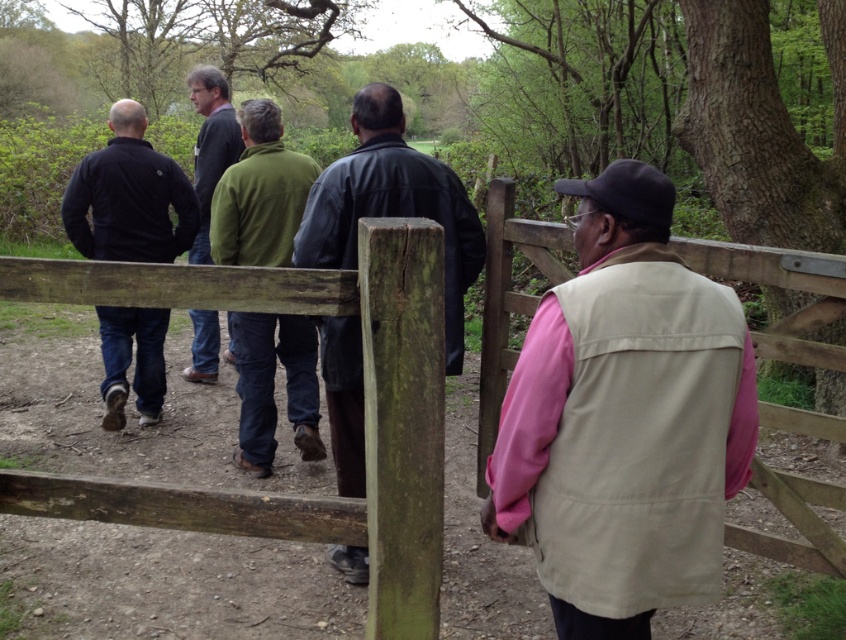
Question: Can you confirm if beige fabric vest at right is wider than leather jacket at center?

Choices:
 (A) yes
 (B) no

Answer: (B)

Question: Estimate the real-world distances between objects in this image. Which object is farther from the dark blue jacket at left?

Choices:
 (A) green fleece jacket at center
 (B) beige fabric vest at right

Answer: (B)

Question: Which of the following is the closest to the observer?

Choices:
 (A) (476, 218)
 (B) (243, 397)
 (C) (378, 531)
 (D) (679, 404)

Answer: (D)

Question: Is green fleece jacket at center wider than dark blue jacket at left?

Choices:
 (A) yes
 (B) no

Answer: (B)

Question: Considering the real-world distances, which object is closest to the wooden fence at center?

Choices:
 (A) leather jacket at center
 (B) green fleece jacket at center
 (C) green mossy wood at center
 (D) dark blue jacket at left

Answer: (C)

Question: Is wooden fence at center closer to the viewer compared to dark gray sweater at center?

Choices:
 (A) no
 (B) yes

Answer: (B)